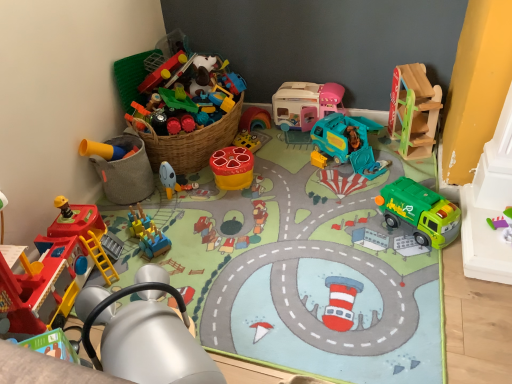
Where is `wooden slide at upper right, marked as the 1th toy in a right-to-left arrangement`? wooden slide at upper right, marked as the 1th toy in a right-to-left arrangement is located at coordinates (413, 111).

Measure the distance between point (x=234, y=152) and camera.

Point (x=234, y=152) and camera are 1.77 meters apart from each other.

This screenshot has height=384, width=512. In order to click on pastel pink plastic camper at center, which ranks as the fourth toy in right-to-left order in this screenshot , I will do `click(306, 103)`.

Is wooden slide at upper right, marked as the ninth toy in a left-to-right arrangement, in front of matte plastic toy at center, which is the 3th toy in left-to-right order?

Yes.

Which object is thinner, wooden slide at upper right, marked as the ninth toy in a left-to-right arrangement, or matte plastic toy at center, which is the 3th toy in left-to-right order?

matte plastic toy at center, which is the 3th toy in left-to-right order.

Locate an element on the screen. This screenshot has height=384, width=512. toy that is the 1st one when counting forward from the matte plastic toy at center, which is the 3th toy in left-to-right order is located at coordinates (413, 111).

Is matte plastic toy at center, the 7th toy viewed from the right, at the back of pastel pink plastic camper at center, marked as the sixth toy in a left-to-right arrangement?

pastel pink plastic camper at center, marked as the sixth toy in a left-to-right arrangement, is not turned away from matte plastic toy at center, the 7th toy viewed from the right.

Is pastel pink plastic camper at center, which ranks as the fourth toy in right-to-left order, located outside matte plastic toy at center, the 7th toy viewed from the right?

Yes, pastel pink plastic camper at center, which ranks as the fourth toy in right-to-left order, is located beyond the bounds of matte plastic toy at center, the 7th toy viewed from the right.

What's the angular difference between pastel pink plastic camper at center, marked as the sixth toy in a left-to-right arrangement, and matte plastic toy at center, the 7th toy viewed from the right,'s facing directions?

The angle between the facing direction of pastel pink plastic camper at center, marked as the sixth toy in a left-to-right arrangement, and the facing direction of matte plastic toy at center, the 7th toy viewed from the right, is 90 degrees.

Looking at this image, from the image's perspective, is pastel pink plastic camper at center, which ranks as the fourth toy in right-to-left order, above or below matte plastic toy at center, the 7th toy viewed from the right?

From the image's perspective, pastel pink plastic camper at center, which ranks as the fourth toy in right-to-left order, appears above matte plastic toy at center, the 7th toy viewed from the right.

From a real-world perspective, is green plastic garbage truck at lower right, which is the 8th toy in left-to-right order, positioned over teal plastic garbage truck at center, acting as the 7th toy starting from the left, based on gravity?

No, from a real-world perspective, green plastic garbage truck at lower right, which is the 8th toy in left-to-right order, is not above teal plastic garbage truck at center, acting as the 7th toy starting from the left.

Which point is more distant from viewer, [440,204] or [364,157]?

Point [364,157]

Which is behind, green plastic garbage truck at lower right, which appears as the second toy when viewed from the right, or teal plastic garbage truck at center, acting as the 7th toy starting from the left?

Positioned behind is teal plastic garbage truck at center, acting as the 7th toy starting from the left.

Which object is thinner, matte plastic stool at center, the fifth toy from the left, or metallic yellow crane at lower left, the sixth toy from the right?

matte plastic stool at center, the fifth toy from the left, is thinner.

Is point (220, 161) positioned behind point (111, 303)?

Yes.

Would you consider matte plastic stool at center, the fifth toy from the left, to be distant from metallic yellow crane at lower left, the sixth toy from the right?

No, there isn't a large distance between matte plastic stool at center, the fifth toy from the left, and metallic yellow crane at lower left, the sixth toy from the right.

Is metallic yellow crane at lower left, which is counted as the 4th toy, starting from the left, surrounded by matte plastic stool at center, the 5th toy from the right?

No.

Is wooden slide at upper right, marked as the 1th toy in a right-to-left arrangement, directly adjacent to teal plastic garbage truck at center, marked as the 3th toy in a right-to-left arrangement?

They are not placed beside each other.

Considering the sizes of objects wooden slide at upper right, marked as the ninth toy in a left-to-right arrangement, and teal plastic garbage truck at center, marked as the 3th toy in a right-to-left arrangement, in the image provided, who is bigger, wooden slide at upper right, marked as the ninth toy in a left-to-right arrangement, or teal plastic garbage truck at center, marked as the 3th toy in a right-to-left arrangement,?

With larger size is wooden slide at upper right, marked as the ninth toy in a left-to-right arrangement.

Who is more distant, wooden slide at upper right, marked as the 1th toy in a right-to-left arrangement, or teal plastic garbage truck at center, marked as the 3th toy in a right-to-left arrangement?

teal plastic garbage truck at center, marked as the 3th toy in a right-to-left arrangement, is more distant.

How far apart are wooden slide at upper right, marked as the 1th toy in a right-to-left arrangement, and teal plastic garbage truck at center, acting as the 7th toy starting from the left?

wooden slide at upper right, marked as the 1th toy in a right-to-left arrangement, is 9.17 inches from teal plastic garbage truck at center, acting as the 7th toy starting from the left.

In the scene shown: How different are the orientations of blue plastic train at center, which appears as the 2th toy when viewed from the left, and yellow matte bucket at lower left, the first toy in the left-to-right sequence, in degrees?

The angular difference between blue plastic train at center, which appears as the 2th toy when viewed from the left, and yellow matte bucket at lower left, the first toy in the left-to-right sequence, is 41.9 degrees.

Is blue plastic train at center, which appears as the 2th toy when viewed from the left, situated inside yellow matte bucket at lower left, the 9th toy when ordered from right to left, or outside?

blue plastic train at center, which appears as the 2th toy when viewed from the left, is located beyond the bounds of yellow matte bucket at lower left, the 9th toy when ordered from right to left.

Is point (137, 233) farther from viewer compared to point (122, 141)?

No.

Which of these two, blue plastic train at center, acting as the 8th toy starting from the right, or yellow matte bucket at lower left, the first toy in the left-to-right sequence, is wider?

Wider between the two is blue plastic train at center, acting as the 8th toy starting from the right.

Looking at this image, is blue plastic train at center, acting as the 8th toy starting from the right, in front of or behind matte plastic toy at center, which is the 3th toy in left-to-right order, in the image?

blue plastic train at center, acting as the 8th toy starting from the right, is positioned closer to the viewer than matte plastic toy at center, which is the 3th toy in left-to-right order.

From the image's perspective, who appears lower, blue plastic train at center, acting as the 8th toy starting from the right, or matte plastic toy at center, which is the 3th toy in left-to-right order?

blue plastic train at center, acting as the 8th toy starting from the right.

Is point (137, 220) closer to camera compared to point (170, 184)?

That is True.

The width and height of the screenshot is (512, 384). Identify the location of the 1st toy counting from the right side of the blue plastic train at center, which appears as the 2th toy when viewed from the left. (172, 180).

From the image's perspective, starting from the matte plastic toy at center, the 7th toy viewed from the right, which toy is the 4th one above? Please provide its 2D coordinates.

[(413, 111)]

Identify the location of the 3rd toy located above the matte plastic toy at center, which is the 3th toy in left-to-right order (from a real-world perspective). (306, 103).

From the image, which object appears to be farther from matte plastic toy at center, which is the 3th toy in left-to-right order, wooden slide at upper right, marked as the 1th toy in a right-to-left arrangement, or pastel pink plastic camper at center, which ranks as the fourth toy in right-to-left order?

wooden slide at upper right, marked as the 1th toy in a right-to-left arrangement, lies further to matte plastic toy at center, which is the 3th toy in left-to-right order, than the other object.

When comparing their distances from wooden slide at upper right, marked as the 1th toy in a right-to-left arrangement, does teal plastic garbage truck at center, acting as the 7th toy starting from the left, or green plastic garbage truck at lower right, which is the 8th toy in left-to-right order, seem closer?

teal plastic garbage truck at center, acting as the 7th toy starting from the left, lies closer to wooden slide at upper right, marked as the 1th toy in a right-to-left arrangement, than the other object.

Which object lies further to the anchor point metallic yellow crane at lower left, which is counted as the 4th toy, starting from the left, teal plastic garbage truck at center, acting as the 7th toy starting from the left, or matte plastic stool at center, the 5th toy from the right?

teal plastic garbage truck at center, acting as the 7th toy starting from the left.

When comparing their distances from wooden slide at upper right, marked as the ninth toy in a left-to-right arrangement, does yellow matte bucket at lower left, the 9th toy when ordered from right to left, or matte plastic stool at center, the fifth toy from the left, seem further?

Among the two, yellow matte bucket at lower left, the 9th toy when ordered from right to left, is located further to wooden slide at upper right, marked as the ninth toy in a left-to-right arrangement.

Considering their positions, is blue plastic train at center, acting as the 8th toy starting from the right, positioned further to yellow matte bucket at lower left, the 9th toy when ordered from right to left, than teal plastic garbage truck at center, acting as the 7th toy starting from the left?

The object further to yellow matte bucket at lower left, the 9th toy when ordered from right to left, is teal plastic garbage truck at center, acting as the 7th toy starting from the left.

Which object lies further to the anchor point metallic yellow crane at lower left, which is counted as the 4th toy, starting from the left, matte plastic toy at center, which is the 3th toy in left-to-right order, or yellow matte bucket at lower left, the 9th toy when ordered from right to left?

matte plastic toy at center, which is the 3th toy in left-to-right order, is further to metallic yellow crane at lower left, which is counted as the 4th toy, starting from the left.

Looking at this image, which object lies nearer to the anchor point wooden slide at upper right, marked as the 1th toy in a right-to-left arrangement, matte plastic stool at center, the fifth toy from the left, or pastel pink plastic camper at center, which ranks as the fourth toy in right-to-left order?

The object closer to wooden slide at upper right, marked as the 1th toy in a right-to-left arrangement, is pastel pink plastic camper at center, which ranks as the fourth toy in right-to-left order.

Considering their positions, is teal plastic garbage truck at center, marked as the 3th toy in a right-to-left arrangement, positioned further to matte plastic toy at center, which is the 3th toy in left-to-right order, than green plastic garbage truck at lower right, which is the 8th toy in left-to-right order?

green plastic garbage truck at lower right, which is the 8th toy in left-to-right order, is positioned further to the anchor matte plastic toy at center, which is the 3th toy in left-to-right order.

Where is `toy located between matte plastic stool at center, the 5th toy from the right, and teal plastic garbage truck at center, marked as the 3th toy in a right-to-left arrangement, in the left-right direction`? The height and width of the screenshot is (384, 512). toy located between matte plastic stool at center, the 5th toy from the right, and teal plastic garbage truck at center, marked as the 3th toy in a right-to-left arrangement, in the left-right direction is located at coordinates (306, 103).